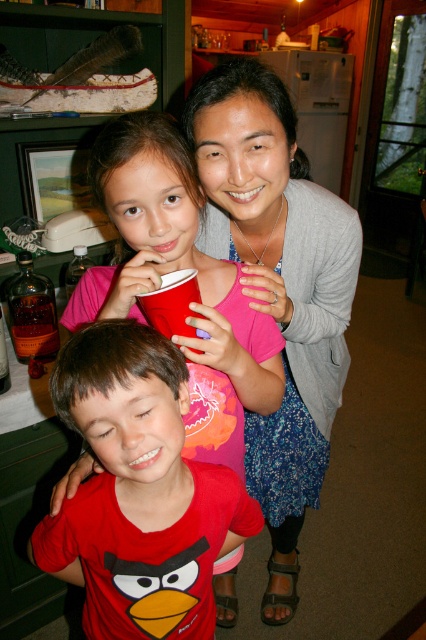
Question: Estimate the real-world distances between objects in this image. Which object is closer to the red matte angry bird shirt at lower left?

Choices:
 (A) gray knit sweater at upper center
 (B) brown glass bottle at lower left

Answer: (A)

Question: Estimate the real-world distances between objects in this image. Which object is farther from the gray knit sweater at upper center?

Choices:
 (A) red matte angry bird shirt at lower left
 (B) brown glass bottle at lower left

Answer: (B)

Question: Is gray knit sweater at upper center below brown glass bottle at lower left?

Choices:
 (A) no
 (B) yes

Answer: (B)

Question: Does gray knit sweater at upper center have a greater width compared to brown glass bottle at lower left?

Choices:
 (A) yes
 (B) no

Answer: (A)

Question: Does red matte angry bird shirt at lower left appear on the left side of brown glass bottle at lower left?

Choices:
 (A) no
 (B) yes

Answer: (A)

Question: Which is farther from the brown glass bottle at lower left?

Choices:
 (A) red matte angry bird shirt at lower left
 (B) gray knit sweater at upper center

Answer: (A)